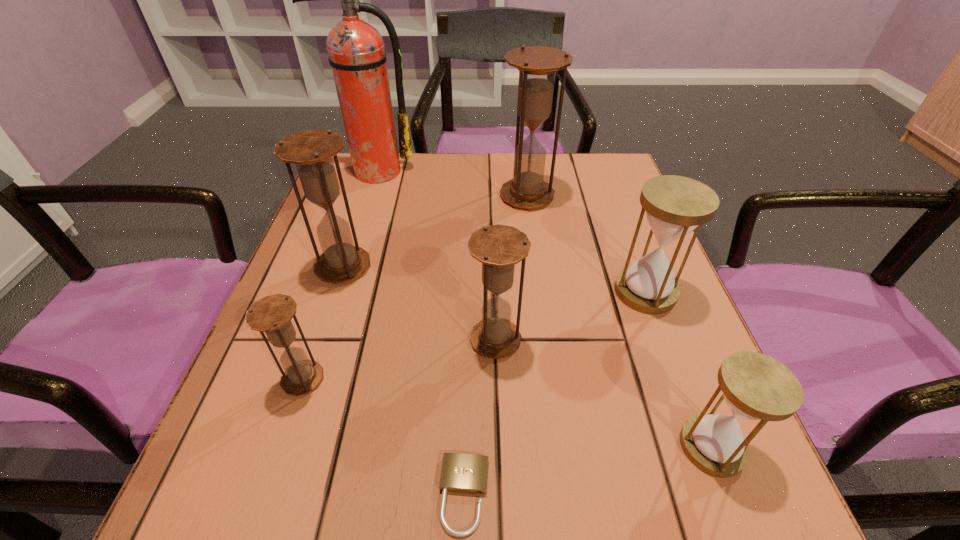
Where is `the smaller white hourglass`? The height and width of the screenshot is (540, 960). the smaller white hourglass is located at coordinates (755, 386).

I want to click on the nearer white hourglass, so [755, 386].

Where is `padlock`? This screenshot has height=540, width=960. padlock is located at coordinates (463, 473).

Where is `beige padlock`? beige padlock is located at coordinates (463, 473).

Locate an element on the screen. Image resolution: width=960 pixels, height=540 pixels. free space located 0.250m at the nozzle of the fire extinguisher is located at coordinates (349, 249).

The height and width of the screenshot is (540, 960). I want to click on vacant space positioned 0.130m on the right of the seventh shortest object, so click(x=609, y=196).

Locate an element on the screen. This screenshot has height=540, width=960. free space located 0.060m on the front of the third tallest object is located at coordinates (329, 309).

The width and height of the screenshot is (960, 540). Find the location of `blank space located on the right of the third biggest brown hourglass`. blank space located on the right of the third biggest brown hourglass is located at coordinates (681, 340).

The width and height of the screenshot is (960, 540). Identify the location of free space located on the back of the bigger white hourglass. (627, 242).

You are a GUI agent. You are given a task and a screenshot of the screen. Output one action in this format:
    pyautogui.click(x=<x>, y=<y>)
    Task: Click on the vacant space located 0.240m on the back of the smallest brown hourglass
    The height and width of the screenshot is (540, 960).
    Given the screenshot: What is the action you would take?
    pyautogui.click(x=342, y=262)